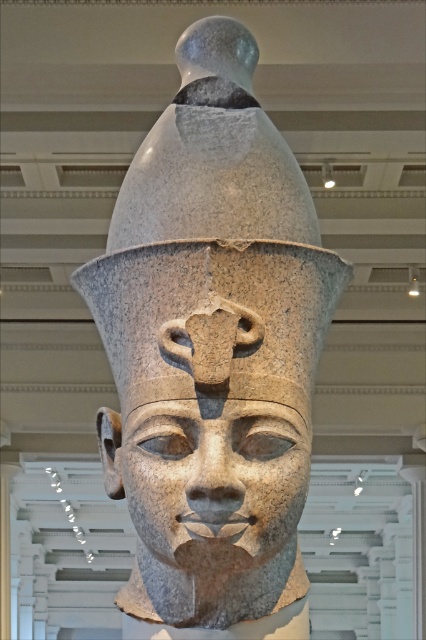
Is granite statue at center taller than granite statue at upper center?

Incorrect, granite statue at center's height is not larger of granite statue at upper center's.

Between granite statue at center and granite statue at upper center, which one has less height?

granite statue at center is shorter.

Between point (138, 596) and point (181, 38), which one is positioned in front?

Positioned in front is point (138, 596).

Find the location of a particular element. This screenshot has height=640, width=426. granite statue at center is located at coordinates click(213, 365).

Measure the distance between granite statue at center and camera.

They are 7.45 meters apart.

Does granite statue at center have a lesser width compared to granite face at center?

Yes.

Identify the location of granite statue at center. Image resolution: width=426 pixels, height=640 pixels. [x=213, y=365].

Find the location of a particular element. granite statue at center is located at coordinates (213, 365).

Is granite face at center to the right of granite statue at upper center from the viewer's perspective?

Indeed, granite face at center is positioned on the right side of granite statue at upper center.

Who is shorter, granite face at center or granite statue at upper center?

Standing shorter between the two is granite statue at upper center.

This screenshot has width=426, height=640. What do you see at coordinates (213, 480) in the screenshot? I see `granite face at center` at bounding box center [213, 480].

The width and height of the screenshot is (426, 640). In order to click on granite face at center in this screenshot , I will do `click(213, 480)`.